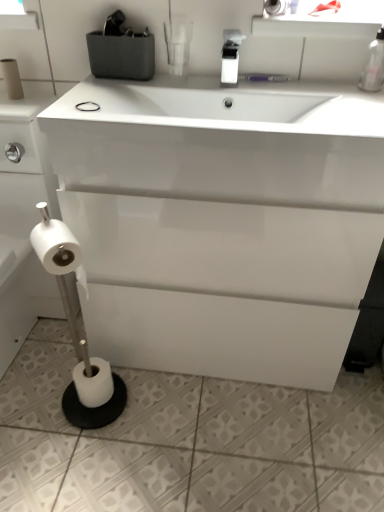
Locate an element on the screen. The width and height of the screenshot is (384, 512). vacant space that's between transparent glass spray bottle at upper right, positioned as the second bottle in left-to-right order, and white glossy soap dispenser at upper center, which is counted as the 1th bottle, starting from the left is located at coordinates (297, 88).